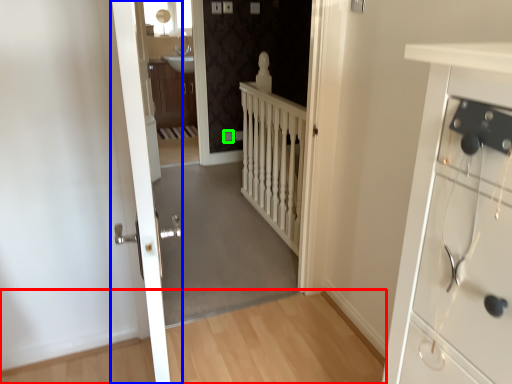
Question: Based on their relative distances, which object is nearer to path (highlighted by a red box)? Choose from door (highlighted by a blue box) and electric outlet (highlighted by a green box).

Choices:
 (A) door
 (B) electric outlet

Answer: (A)